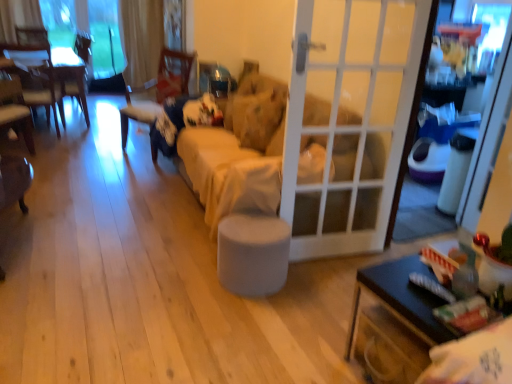
Find the location of a particular element. This screenshot has width=512, height=384. vacant area on top of gray fabric stool at center (from a real-world perspective) is located at coordinates (248, 220).